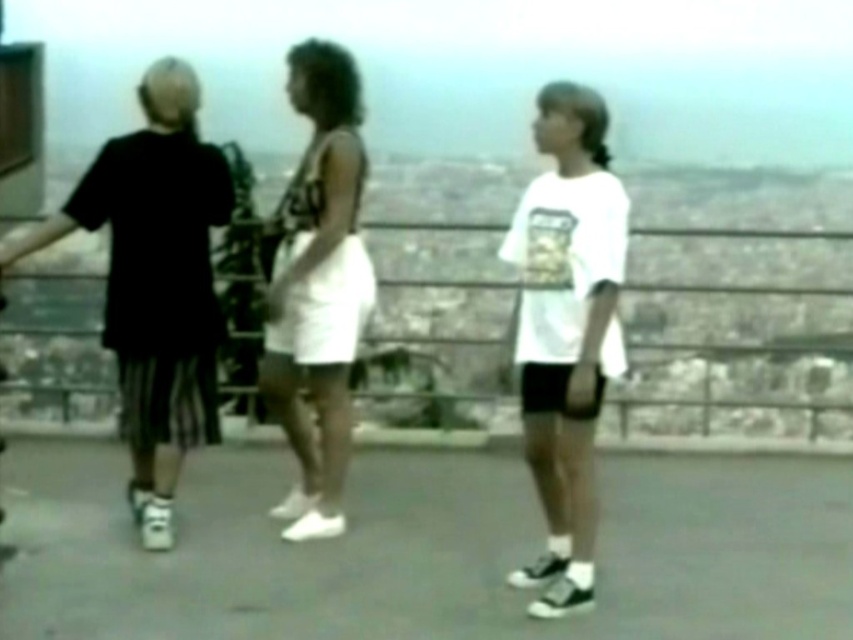
From the picture: You are one of the three people standing on the rooftop. You want to move from your current position to the point marked as point (122, 234) and then to point (334, 464). Which point will require you to walk further away from the camera?

Point (334, 464) is further away from the camera than point (122, 234). Therefore, moving to point (334, 464) will require walking further away from the camera.

You are a photographer trying to capture a photo of the black cotton shorts at left and the white matte skirt at center. From the camera position, which object is positioned more to the left?

The black cotton shorts at left is positioned more to the left than the white matte skirt at center.